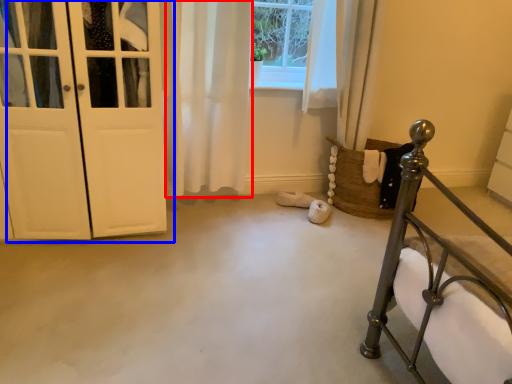
Question: Which point is further to the camera, curtain (highlighted by a red box) or door (highlighted by a blue box)?

Choices:
 (A) curtain
 (B) door

Answer: (A)